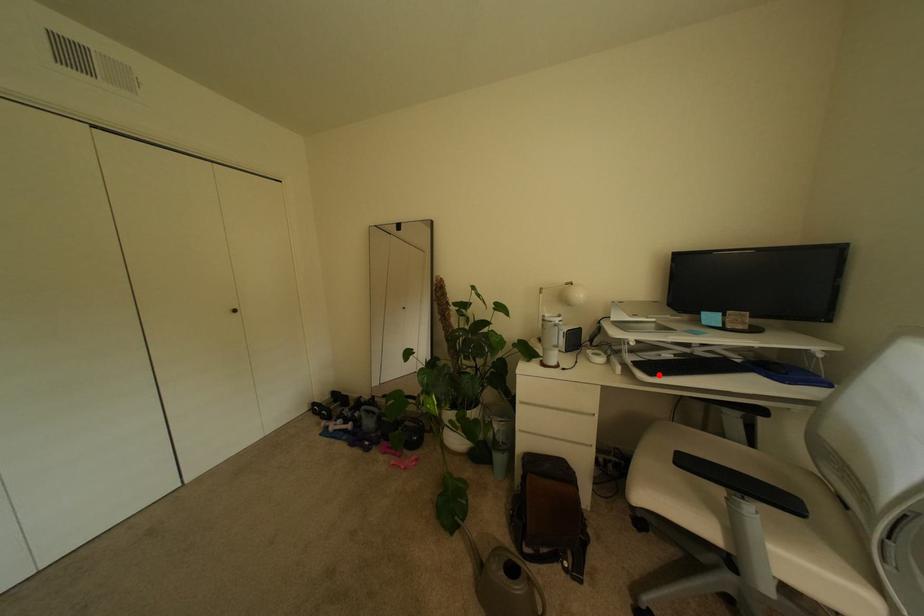
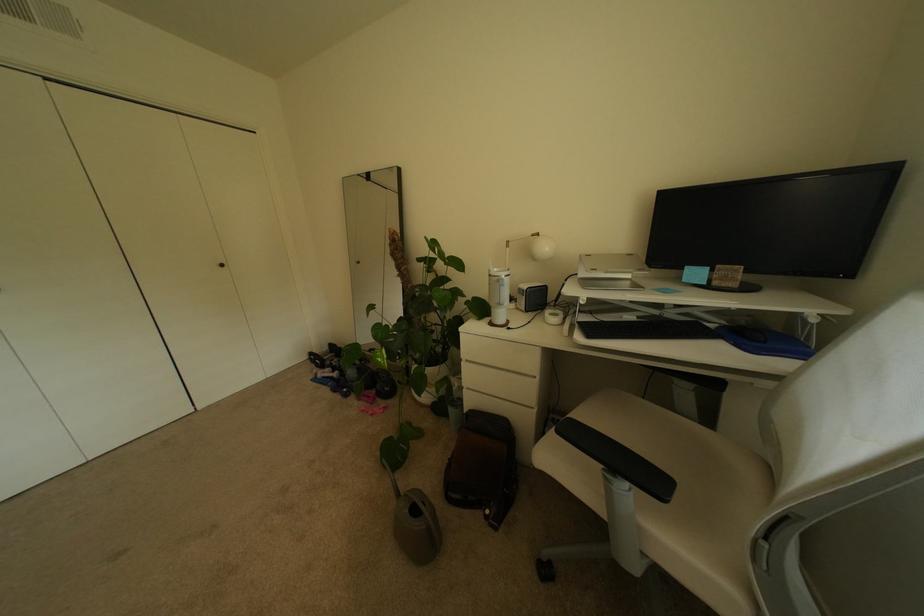
In the second image, find the point that corresponds to the highlighted location in the first image.

(598, 337)